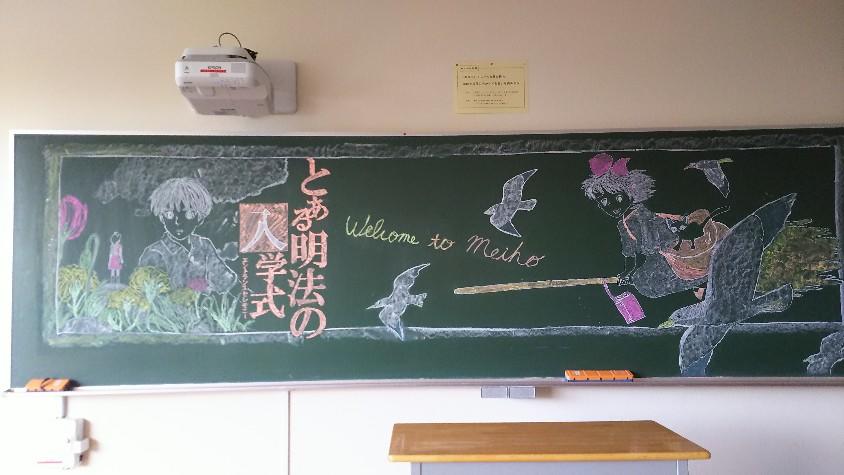
Identify the location of chalk board. Image resolution: width=844 pixels, height=475 pixels. (392, 265).